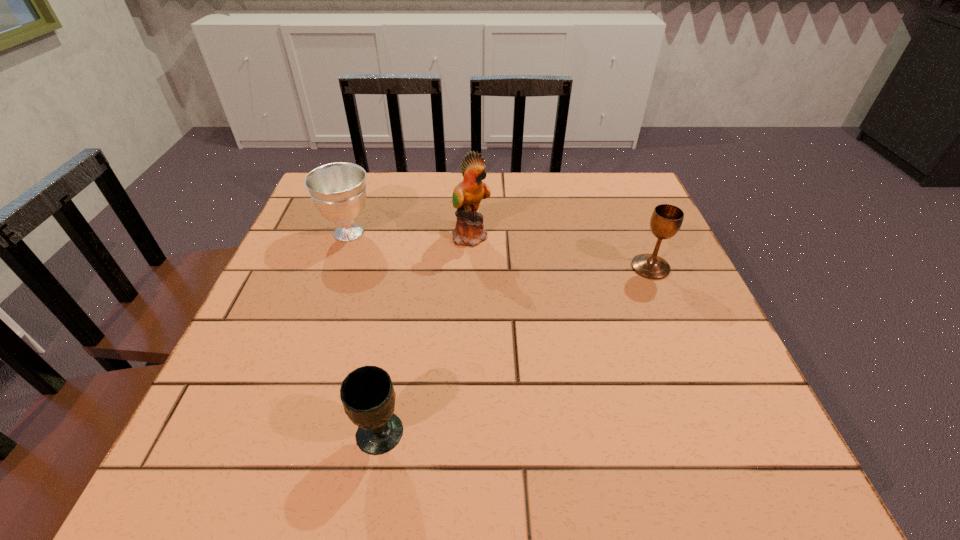
Identify the location of vacant space located on the left of the second farthest chalice. (497, 267).

This screenshot has width=960, height=540. I want to click on free space located on the left of the second object from left to right, so click(324, 434).

Where is `object located in the far edge section of the desktop`? The width and height of the screenshot is (960, 540). object located in the far edge section of the desktop is located at coordinates (338, 190).

Image resolution: width=960 pixels, height=540 pixels. I want to click on object that is at the near edge, so click(x=367, y=394).

Identify the location of object situated at the left edge. The height and width of the screenshot is (540, 960). pos(338,190).

Image resolution: width=960 pixels, height=540 pixels. Identify the location of object that is at the right edge. (666, 220).

Find the location of a particular element. object located at the far left corner is located at coordinates (338, 190).

In the image, there is a desktop. Find the location of `free space at the far edge`. free space at the far edge is located at coordinates (531, 186).

The image size is (960, 540). In the image, there is a desktop. Identify the location of vacant space at the near edge. (345, 474).

Find the location of a particular element. blank space at the left edge of the desktop is located at coordinates (305, 360).